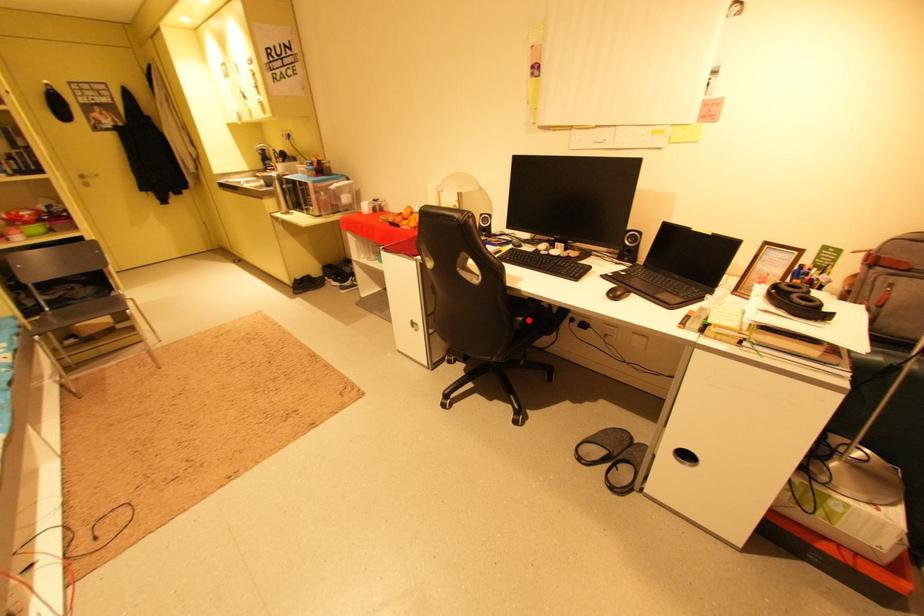
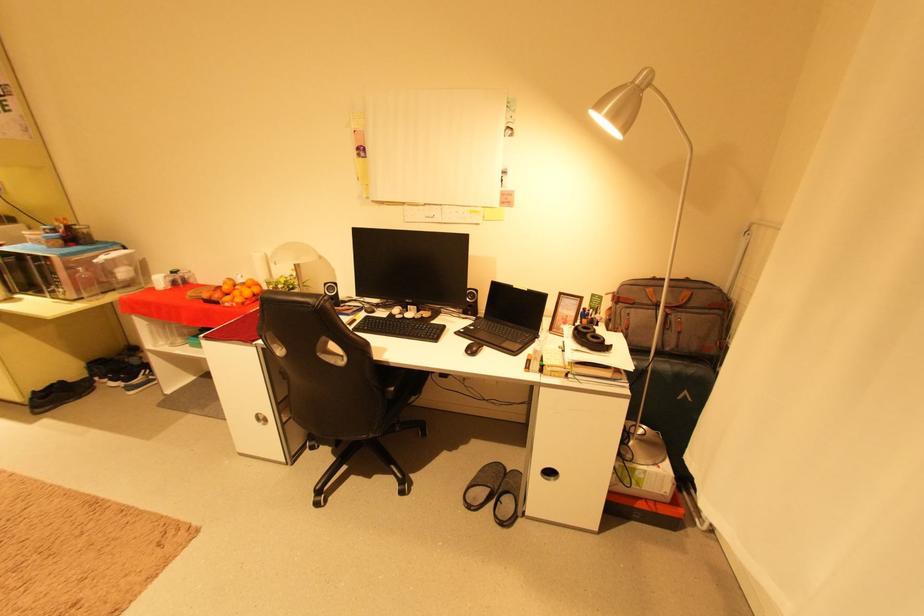
The point at the highlighted location is marked in the first image. Where is the corresponding point in the second image?

(399, 390)